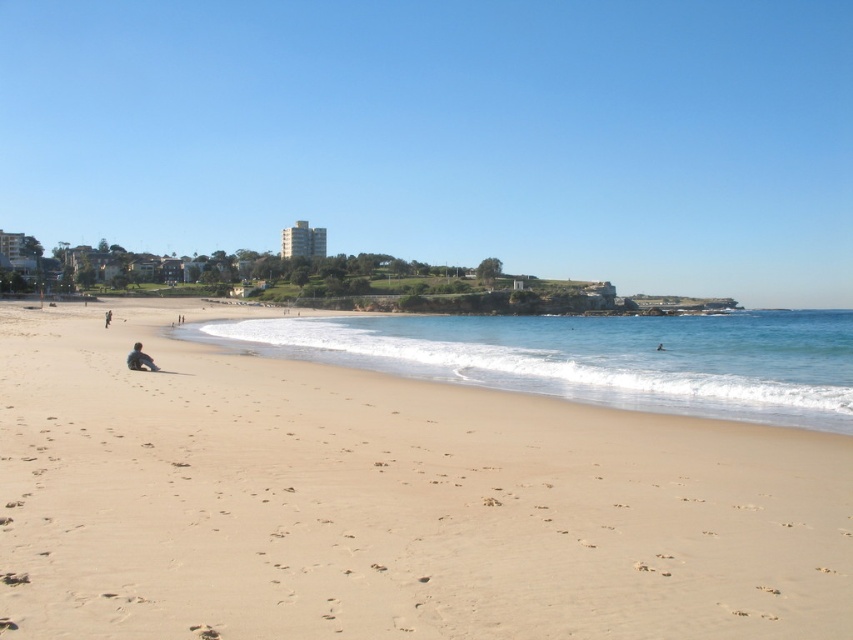
Question: Among these points, which one is nearest to the camera?

Choices:
 (A) (708, 316)
 (B) (181, 321)
 (C) (148, 356)
 (D) (764, 584)

Answer: (D)

Question: Which is nearer to the smooth skin person at lower right?

Choices:
 (A) sandy water at lower center
 (B) light brown sand at center
 (C) dark blue jeans at lower left

Answer: (B)

Question: Is light brown sand at center bigger than dark blue jeans at lower left?

Choices:
 (A) no
 (B) yes

Answer: (B)

Question: Does sandy water at lower center have a smaller size compared to dark blue jeans at lower left?

Choices:
 (A) yes
 (B) no

Answer: (B)

Question: Is dark blue fabric person at lower left wider than light brown sand at lower left?

Choices:
 (A) yes
 (B) no

Answer: (B)

Question: Which of the following is the farthest from the observer?

Choices:
 (A) (180, 314)
 (B) (788, 580)

Answer: (A)